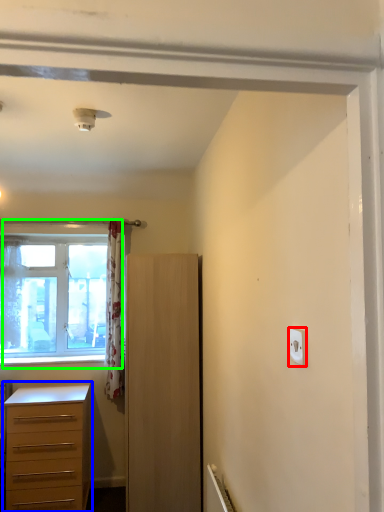
Question: Which object is positioned closest to light switch (highlighted by a red box)? Select from chest of drawers (highlighted by a blue box) and window (highlighted by a green box).

Choices:
 (A) chest of drawers
 (B) window

Answer: (A)